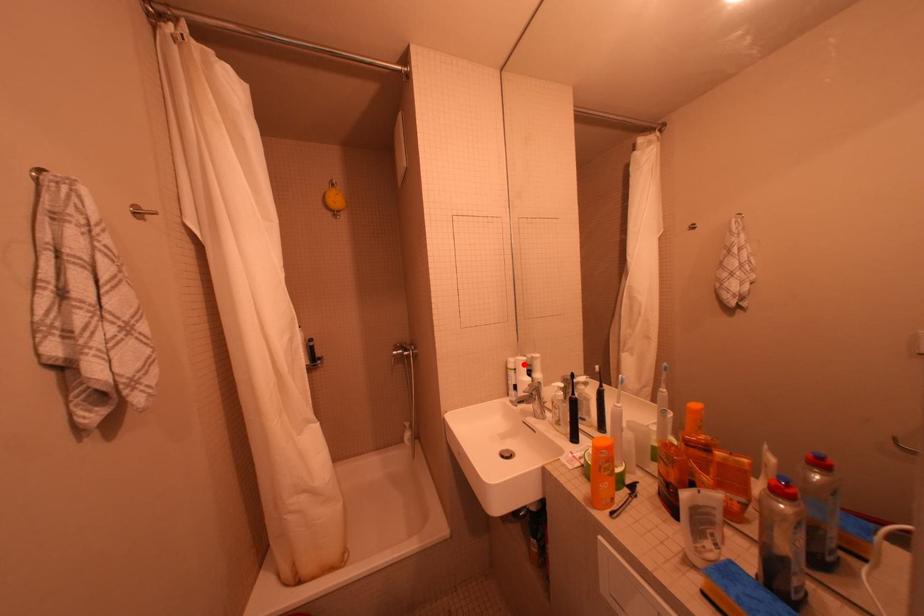
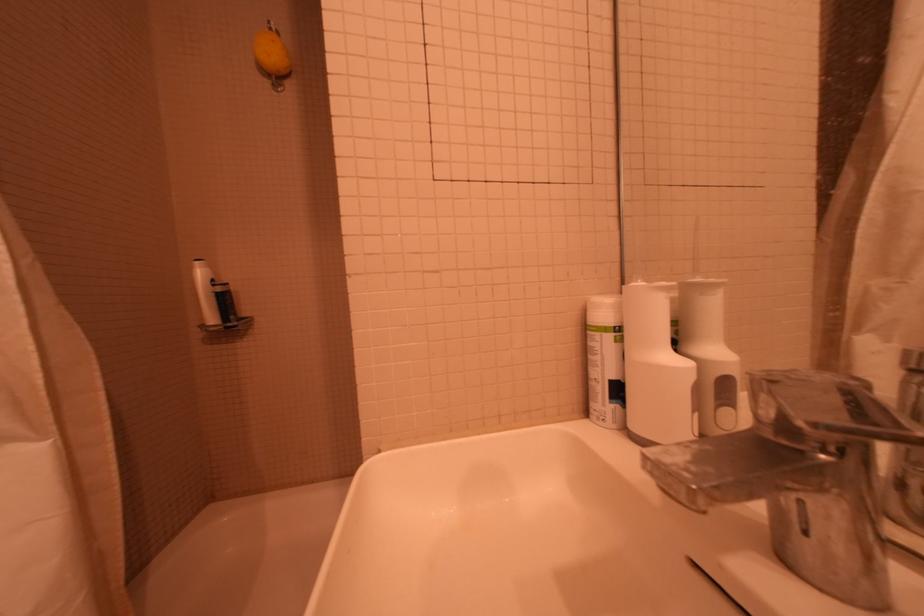
In the second image, find the point that corresponds to the highlighted location in the first image.

(627, 309)